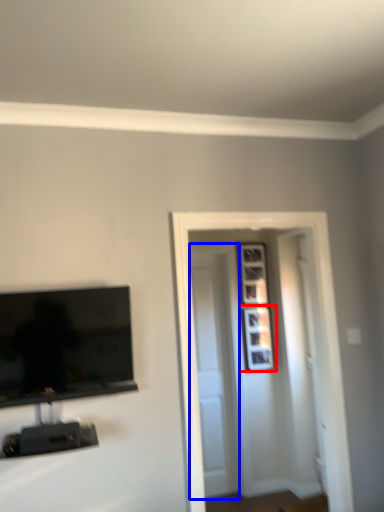
Question: Which object appears closest to the camera in this image, picture frame (highlighted by a red box) or door (highlighted by a blue box)?

Choices:
 (A) picture frame
 (B) door

Answer: (B)